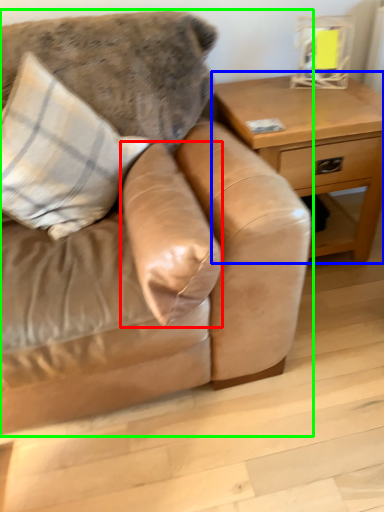
Question: Based on their relative distances, which object is farther from pillow (highlighted by a red box)? Choose from table (highlighted by a blue box) and studio couch (highlighted by a green box).

Choices:
 (A) table
 (B) studio couch

Answer: (A)